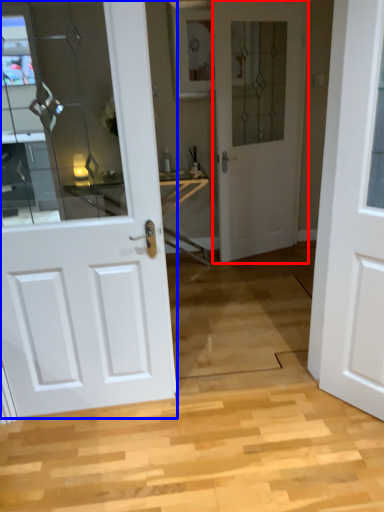
Question: Among these objects, which one is nearest to the camera, door (highlighted by a red box) or door (highlighted by a blue box)?

Choices:
 (A) door
 (B) door

Answer: (B)